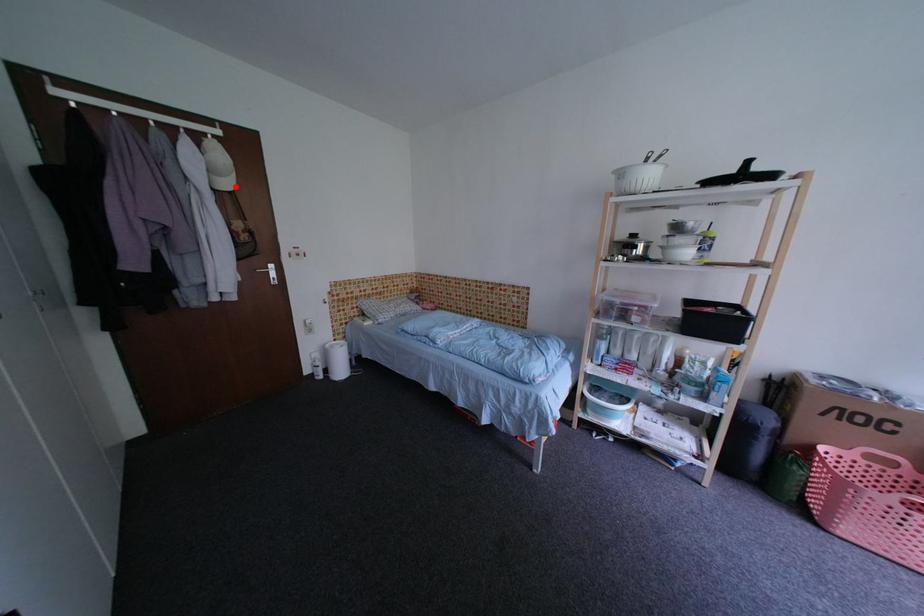
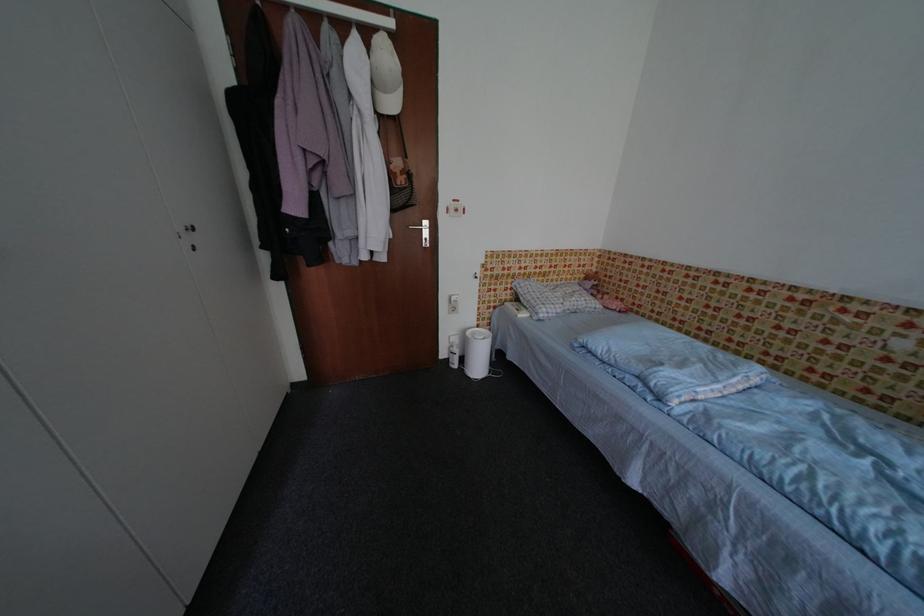
In the second image, find the point that corresponds to the highlighted location in the first image.

(400, 107)